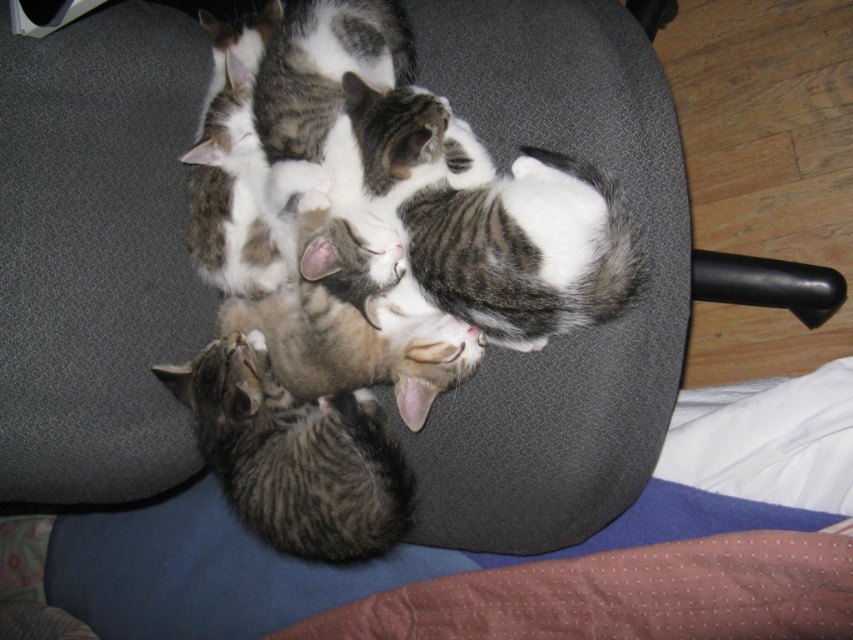
Question: Which object is closer to the camera taking this photo?

Choices:
 (A) striped fur kitten at center
 (B) tabby fur cat at center

Answer: (B)

Question: Can you confirm if tabby fur cat at center is thinner than striped fur kitten at center?

Choices:
 (A) yes
 (B) no

Answer: (B)

Question: Which point is closer to the camera?

Choices:
 (A) [225, 376]
 (B) [247, 264]

Answer: (A)

Question: Does tabby fur cat at center appear on the left side of striped fur kitten at center?

Choices:
 (A) yes
 (B) no

Answer: (B)

Question: Observing the image, what is the correct spatial positioning of tabby fur cat at center in reference to striped fur kitten at center?

Choices:
 (A) left
 (B) right

Answer: (B)